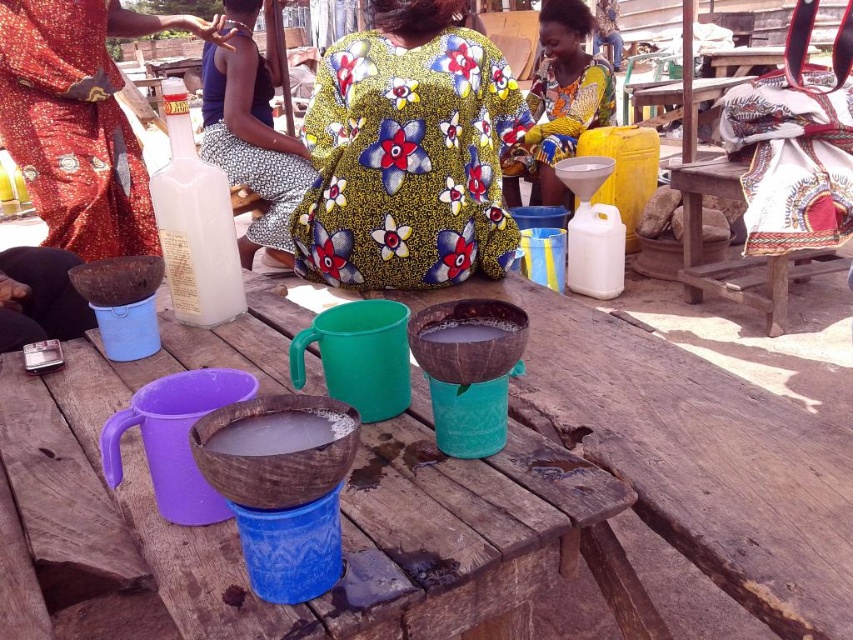
You are organizing a community event and need to determine which clothing item takes up more space horizontally. Based on the scene, which one is wider between the printed fabric skirt at center and the floral fabric dress at upper center?

The floral fabric dress at upper center is wider than the printed fabric skirt at center.

You are organizing a picnic and need to decide where to place your snacks. The wooden table at center and the floral fabric dress at center are both in the scene. Which object would you choose to place your snacks on, and why?

You should place your snacks on the wooden table at center because it is bigger than the floral fabric dress at center, providing a stable and spacious surface for holding items.

You are organizing a picnic and need to decide which item can accommodate more items. Based on the scene, which object between the wooden table at center and the floral fabric dress at center has a greater width?

The wooden table at center has a greater width than the floral fabric dress at center according to the description.